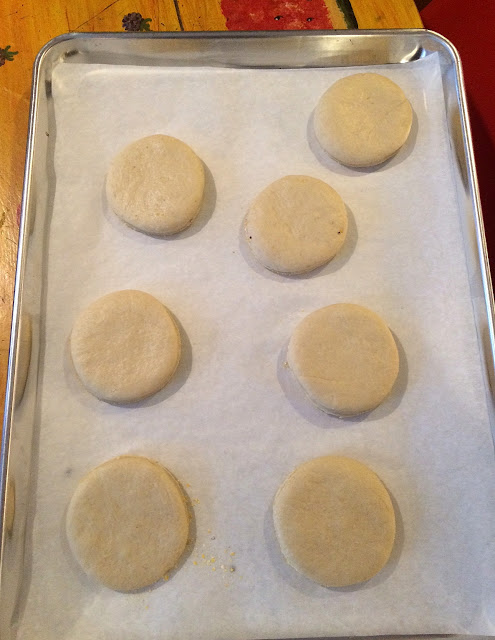
Identify the location of tray. The height and width of the screenshot is (640, 495). (470, 195).